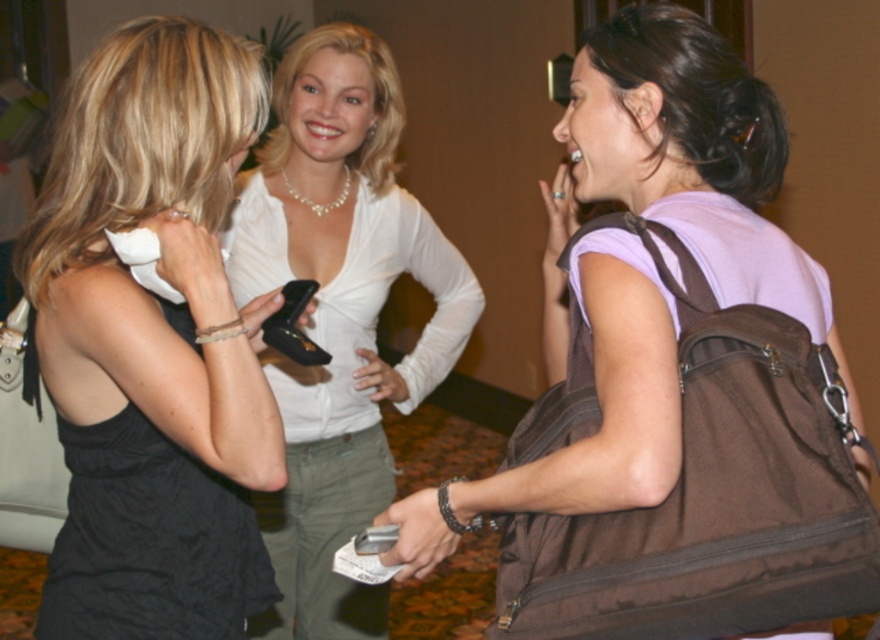
You are a photographer at an event and need to adjust the camera focus. The black satin dress at left and the white satin blouse at center are in your frame. Which one is shorter in height?

The black satin dress at left is not as tall as the white satin blouse at center, so the black satin dress at left is shorter in height.

You are a photographer setting up for an event and need to place a tripod in the scene. The tripod requires a clear space of at least 0.5 meters in diameter. Given the location of the brown fabric backpack at right, can you determine if there is enough space to place the tripod next to it?

The brown fabric backpack at right is located at point (642, 266). Without specific spatial dimensions of the scene, it is impossible to accurately determine if there is enough space to place the tripod next to it. Please provide more information about the scene dimensions or the backpack size.